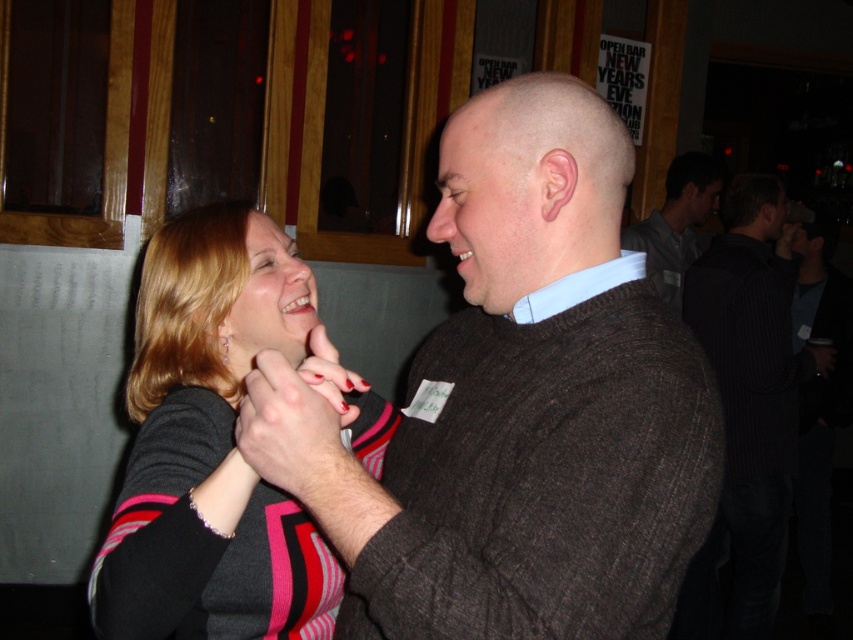
Can you confirm if dark brown sweater at center is shorter than striped sweater at center?

In fact, dark brown sweater at center may be taller than striped sweater at center.

Which of these two, dark brown sweater at center or striped sweater at center, stands taller?

dark brown sweater at center is taller.

Does point (675, 340) come behind point (221, 260)?

No, (675, 340) is in front of (221, 260).

Find the location of `dark brown sweater at center`. dark brown sweater at center is located at coordinates (518, 408).

Where is `striped sweater at center`? striped sweater at center is located at coordinates (219, 444).

Measure the distance between striped sweater at center and camera.

striped sweater at center and camera are 33.58 inches apart from each other.

Where is `striped sweater at center`? The height and width of the screenshot is (640, 853). striped sweater at center is located at coordinates pyautogui.click(x=219, y=444).

Is dark brown sweater at center further to the viewer compared to black pinstripe sweater at right?

No, dark brown sweater at center is in front of black pinstripe sweater at right.

Looking at this image, is dark brown sweater at center wider than black pinstripe sweater at right?

No, dark brown sweater at center is not wider than black pinstripe sweater at right.

Is point (555, 330) positioned in front of point (827, 365)?

That is True.

Where is `dark brown sweater at center`? This screenshot has height=640, width=853. dark brown sweater at center is located at coordinates (518, 408).